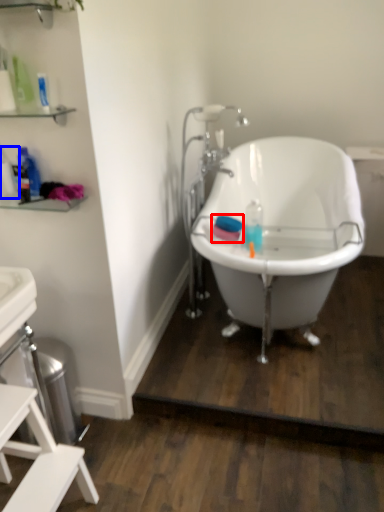
Question: Which point is closer to the camera, mouthwash (highlighted by a red box) or bottle (highlighted by a blue box)?

Choices:
 (A) mouthwash
 (B) bottle

Answer: (B)